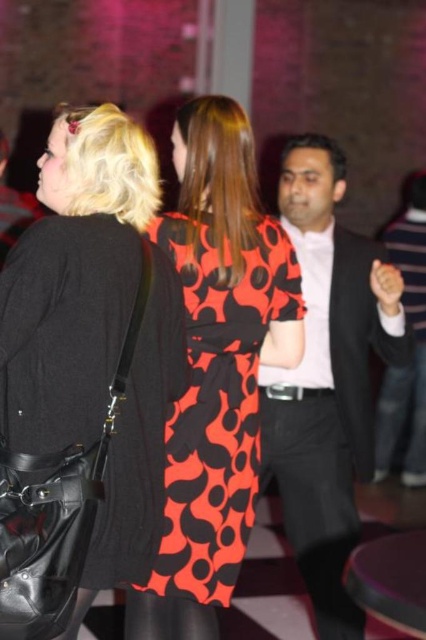
Question: Which point appears closest to the camera in this image?

Choices:
 (A) (374, 342)
 (B) (322, 488)
 (C) (233, 328)

Answer: (C)

Question: Does orange dotted dress at center appear on the left side of black leather belt at center?

Choices:
 (A) yes
 (B) no

Answer: (A)

Question: Is the position of orange dotted dress at center more distant than that of black leather belt at center?

Choices:
 (A) yes
 (B) no

Answer: (B)

Question: Which point appears farthest from the camera in this image?

Choices:
 (A) pos(222,348)
 (B) pos(141,186)

Answer: (A)

Question: Can you confirm if matte black suit at center is bigger than black leather belt at center?

Choices:
 (A) yes
 (B) no

Answer: (A)

Question: Which object is the farthest from the matte black suit at center?

Choices:
 (A) matte black dress at center
 (B) black leather belt at center

Answer: (A)